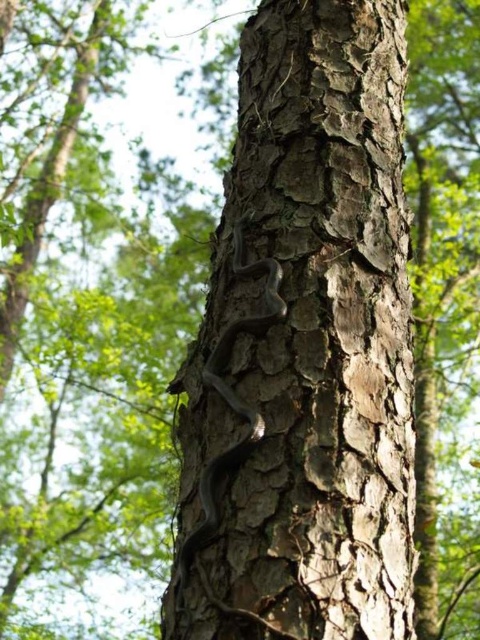
You are standing in front of the tree trunk with the snake. There are two points marked on the snake, one at coordinate point (334, 531) and another at point (215, 470). Which point is nearer to your eyes?

Point (334, 531) is closer to the camera than point (215, 470), so the point at (334, 531) is nearer to your eyes.

You need to determine if the smooth bark tree trunk at center can fully encircle the shiny black snake at center. Based on their widths, can the tree trunk at center completely wrap around the snake?

The smooth bark tree trunk at center is wider than the shiny black snake at center. Therefore, the tree trunk at center can fully encircle the snake.

You are a wildlife photographer aiming to capture a clear photo of both the smooth bark tree trunk at center and the shiny black snake at center. Your camera has a depth of field that can focus on objects within 5 inches of each other. Can you focus on both subjects simultaneously?

The distance between the smooth bark tree trunk at center and the shiny black snake at center is 6.04 inches. Since your camera requires subjects to be within 5 inches of each other for clear focus, you cannot focus on both simultaneously.